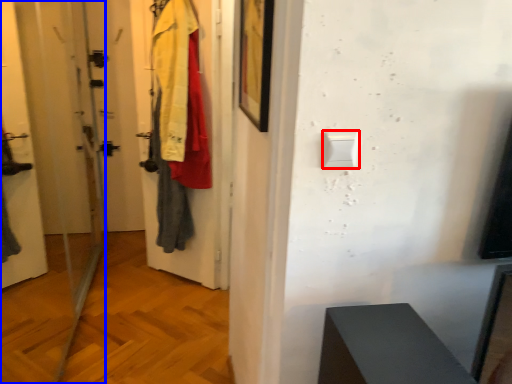
Question: Which object appears farthest to the camera in this image, light switch (highlighted by a red box) or screen door (highlighted by a blue box)?

Choices:
 (A) light switch
 (B) screen door

Answer: (A)